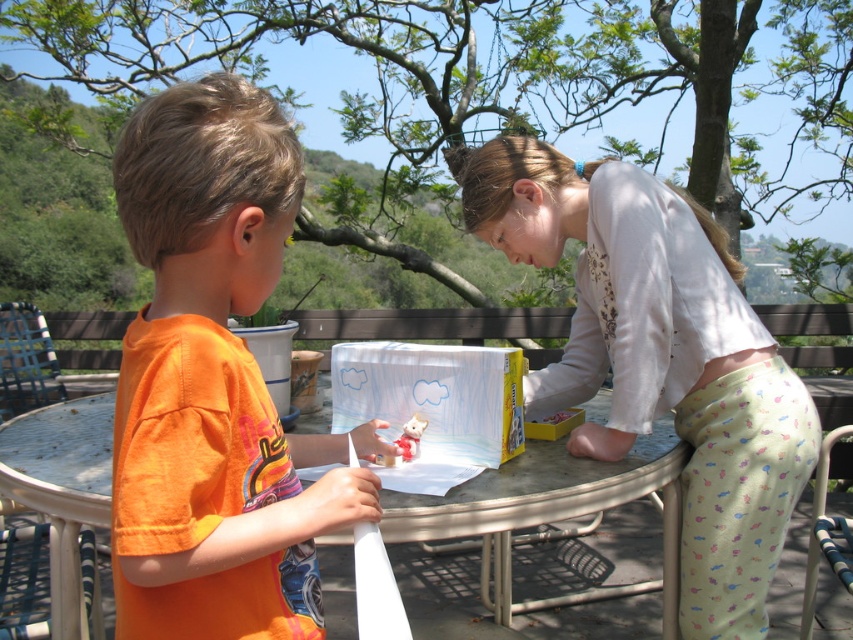
Is orange cotton shirt at center to the right of metallic silver table at center from the viewer's perspective?

Indeed, orange cotton shirt at center is positioned on the right side of metallic silver table at center.

Is point (230, 404) in front of point (492, 472)?

Yes, it is.

Where is `orange cotton shirt at center`? This screenshot has width=853, height=640. orange cotton shirt at center is located at coordinates (213, 381).

Where is `orange cotton shirt at center`? This screenshot has width=853, height=640. orange cotton shirt at center is located at coordinates (213, 381).

Is light beige cotton shirt at center above metallic silver table at center?

Yes, light beige cotton shirt at center is above metallic silver table at center.

In the scene shown: Is light beige cotton shirt at center to the left of metallic silver table at center from the viewer's perspective?

Incorrect, light beige cotton shirt at center is not on the left side of metallic silver table at center.

Which is in front, point (769, 364) or point (612, 504)?

Point (612, 504) is in front.

The height and width of the screenshot is (640, 853). What are the coordinates of `light beige cotton shirt at center` in the screenshot? It's located at (659, 356).

Who is shorter, orange cotton shirt at center or light beige cotton shirt at center?

With less height is orange cotton shirt at center.

Measure the distance between point (248, 224) and camera.

A distance of 37.78 inches exists between point (248, 224) and camera.

Is point (184, 444) positioned before point (733, 445)?

Yes, it is.

This screenshot has width=853, height=640. I want to click on orange cotton shirt at center, so click(x=213, y=381).